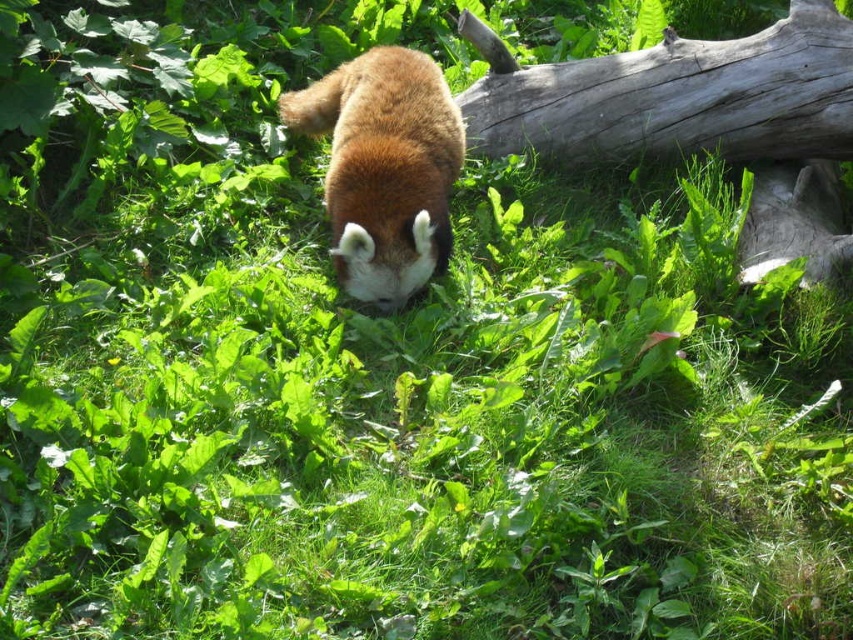
You are standing in a forest and see a red panda in the center. There is a gray rough wood at upper right marked by point (672,96). If you want to move from the red panda to the gray rough wood at upper right, in which direction should you go?

The gray rough wood at upper right is located at point (672,96), so you should move towards the upper right direction from the red panda to reach it.